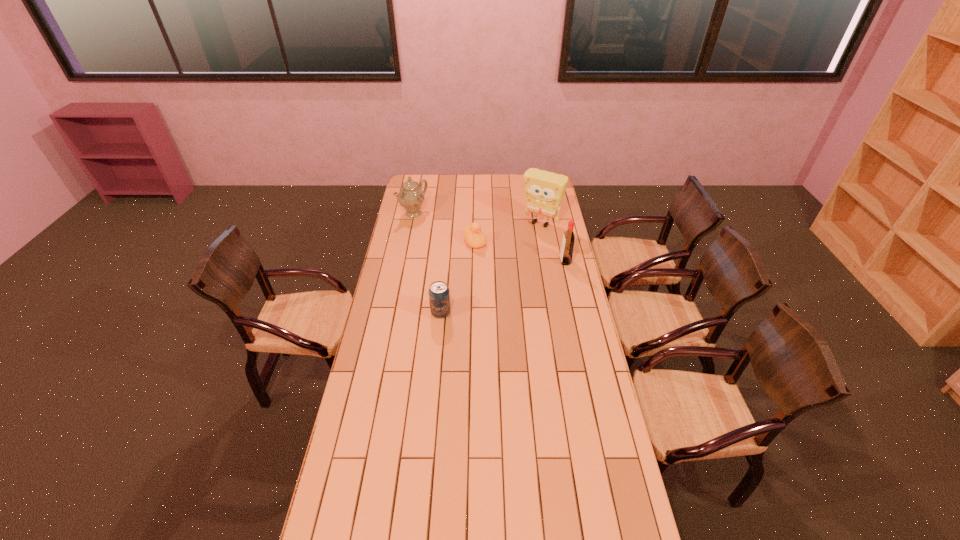
I want to click on free area in between the duck and the fourth farthest object, so click(x=520, y=252).

Identify the location of free area in between the vodka and the pop soda. The image size is (960, 540). (503, 287).

I want to click on vacant point located between the vodka and the tallest object, so [x=553, y=242].

Identify the location of empty space between the vodka and the leftmost object. (490, 237).

This screenshot has width=960, height=540. I want to click on vacant region between the duck and the fourth farthest object, so click(520, 252).

The image size is (960, 540). I want to click on blank region between the shortest object and the tallest object, so click(508, 233).

The height and width of the screenshot is (540, 960). What are the coordinates of `vacant space that is in between the vodka and the tallest object` in the screenshot? It's located at (553, 242).

Identify the location of blank region between the nearest object and the leftmost object. This screenshot has width=960, height=540. (427, 263).

This screenshot has height=540, width=960. I want to click on object that is the closest to the leftmost object, so (473, 237).

Select which object appears as the closest to the vodka. Please provide its 2D coordinates. Your answer should be formatted as a tuple, i.e. [(x, y)], where the tuple contains the x and y coordinates of a point satisfying the conditions above.

[(544, 191)]